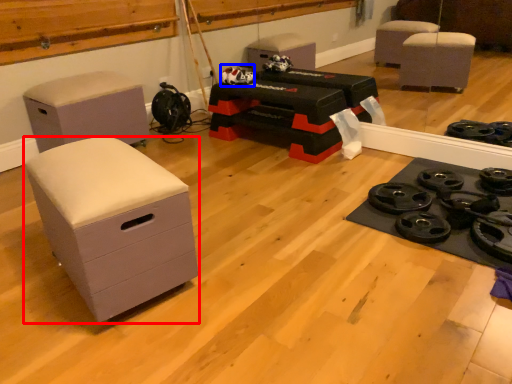
Question: Among these objects, which one is farthest to the camera, chest of drawers (highlighted by a red box) or toy (highlighted by a blue box)?

Choices:
 (A) chest of drawers
 (B) toy

Answer: (B)